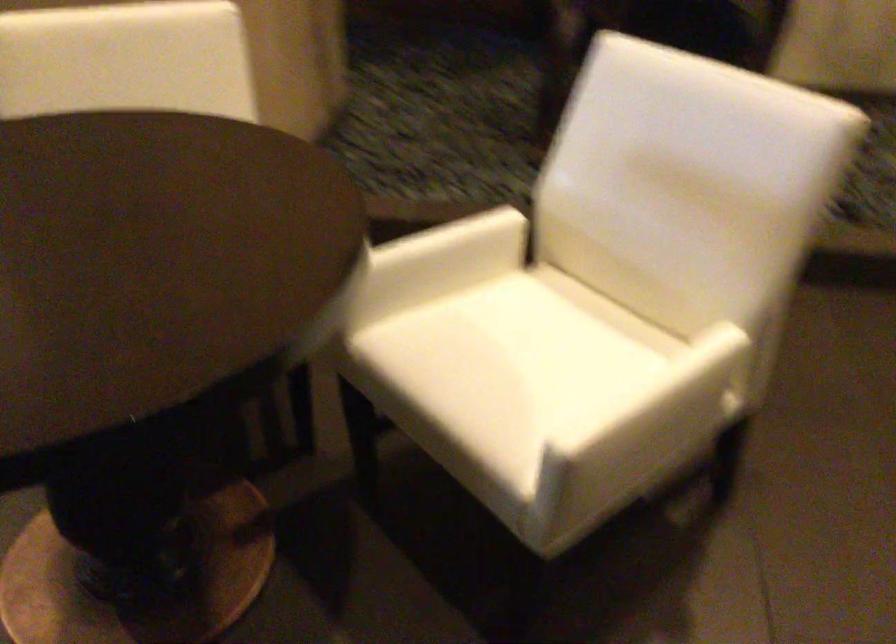
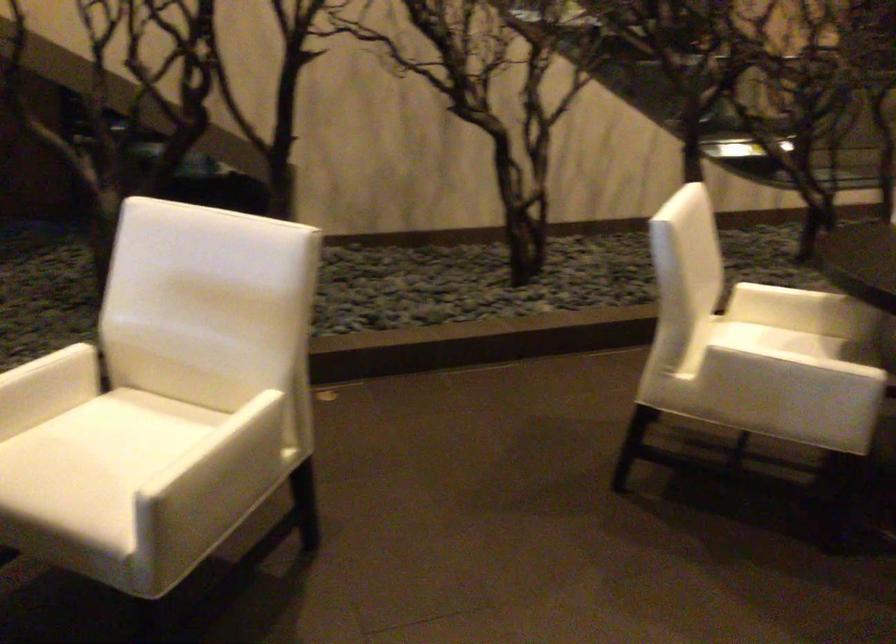
In the second image, find the point that corresponds to pixel 483 229 in the first image.

(58, 362)